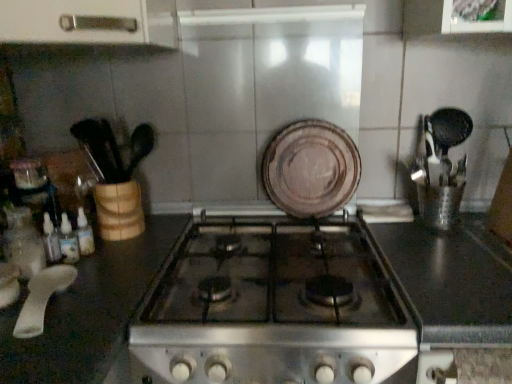
Locate an element on the screen. blank area to the left of brown matte plate at center is located at coordinates (250, 224).